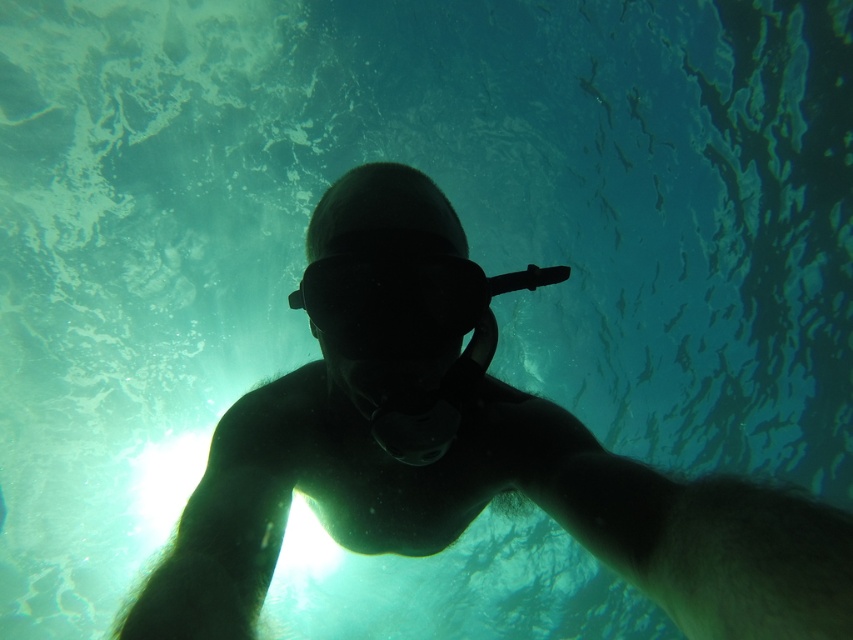
You are a diver preparing to take a selfie underwater. You want to position yourself so that your face is exactly at the point marked as point (270, 387). Given that the distance from you to this point is 1.10 meters, can you safely reach your camera to this point without moving your body?

The distance of point (270, 387) from viewer is 1.10 meters, so yes, you can safely reach your camera to this point without moving your body if your arm length is at least 1.10 meters.

You are a photographer trying to capture the perfect underwater selfie. You notice two points in your frame at coordinates point (407, 364) and point (457, 312). Based on their positions, which point is closer to your camera lens?

Point (407, 364) is closer to the camera than point (457, 312).

You are a photographer trying to capture the silhouette snorkel at center in your shot. The camera is positioned at point A, which is at coordinates 0.3, 0.3. To ensure the snorkel is in focus, you need to adjust the camera to point directly at the snorkel. What are the coordinates you should aim the camera at?

The silhouette snorkel at center is located at point (482, 508), so you should aim the camera at those coordinates to focus on it.